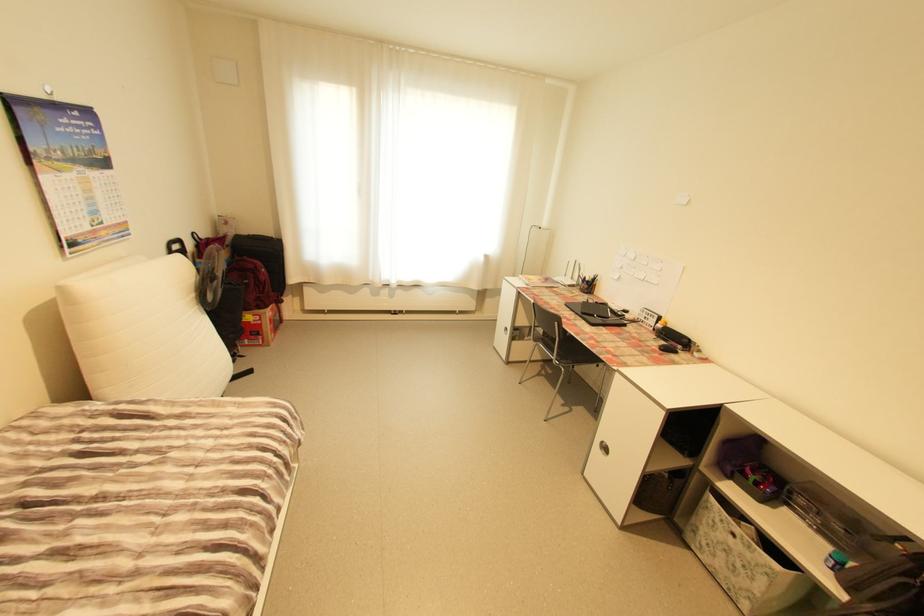
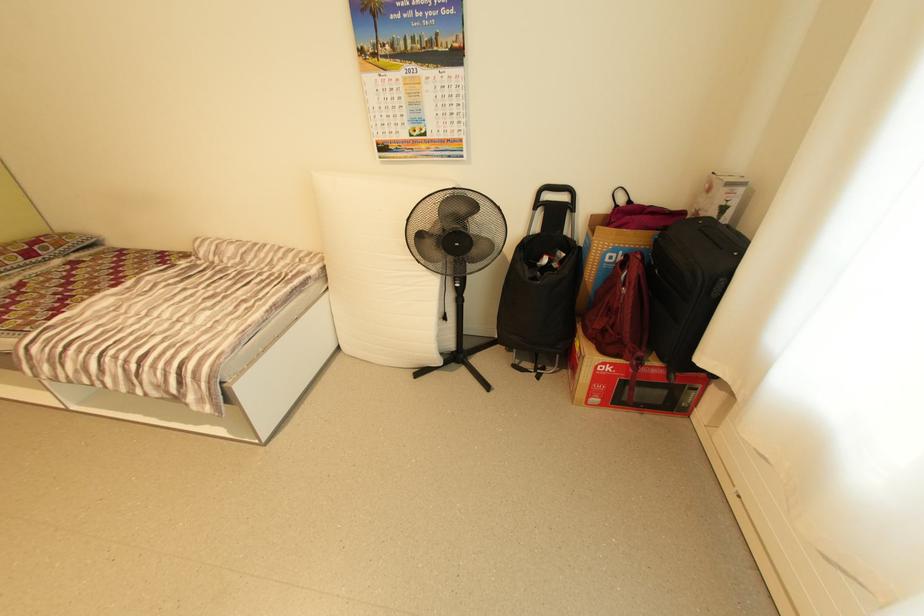
Find the pixel in the second image that matches (x=261, y=315) in the first image.

(586, 347)